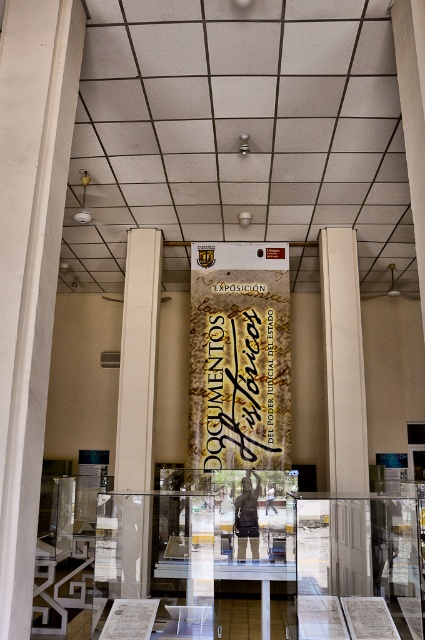
Consider the image. Can you confirm if white smooth pillar at center is positioned above gold calligraphy banner at center?

Correct, white smooth pillar at center is located above gold calligraphy banner at center.

Which is behind, point (147, 456) or point (255, 330)?

Point (255, 330)

Find the location of `white smooth pillar at center`. white smooth pillar at center is located at coordinates (138, 362).

Is beige concrete pillar at center positioned at the back of gold calligraphy banner at center?

A: No, it is not.

Does beige concrete pillar at center have a lesser height compared to gold calligraphy banner at center?

No.

The image size is (425, 640). Describe the element at coordinates (343, 364) in the screenshot. I see `beige concrete pillar at center` at that location.

The height and width of the screenshot is (640, 425). In order to click on beige concrete pillar at center in this screenshot , I will do `click(343, 364)`.

How distant is beige concrete pillar at center from white smooth pillar at center?

beige concrete pillar at center is 2.23 meters from white smooth pillar at center.

Is beige concrete pillar at center wider than white smooth pillar at center?

Yes.

What do you see at coordinates (343, 364) in the screenshot?
I see `beige concrete pillar at center` at bounding box center [343, 364].

At what (x,y) coordinates should I click in order to perform the action: click on beige concrete pillar at center. Please return your answer as a coordinate pair (x, y). The height and width of the screenshot is (640, 425). Looking at the image, I should click on point(343,364).